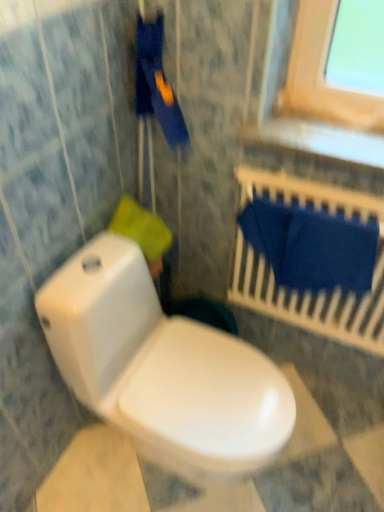
Describe the element at coordinates (309, 290) in the screenshot. This screenshot has height=512, width=384. I see `blue fabric at upper right` at that location.

Where is `white glossy toilet at lower left`? This screenshot has height=512, width=384. white glossy toilet at lower left is located at coordinates (162, 369).

Between blue fabric at upper right and yellow fabric at upper left, which one appears on the right side from the viewer's perspective?

Positioned to the right is blue fabric at upper right.

Is point (383, 292) less distant than point (116, 222)?

Yes, it is.

Can you see blue fabric at upper right touching yellow fabric at upper left?

blue fabric at upper right and yellow fabric at upper left are not in contact.

Consider the image. Considering the sizes of objects blue fabric at upper right and yellow fabric at upper left in the image provided, who is taller, blue fabric at upper right or yellow fabric at upper left?

Standing taller between the two is blue fabric at upper right.

Are white glossy toilet at lower left and blue fabric at upper right far apart?

No.

Could you tell me if white glossy toilet at lower left is turned towards blue fabric at upper right?

No, white glossy toilet at lower left is not oriented towards blue fabric at upper right.

From the image's perspective, is white glossy toilet at lower left over blue fabric at upper right?

No, from the image's perspective, white glossy toilet at lower left is not over blue fabric at upper right.

Locate an element on the screen. The height and width of the screenshot is (512, 384). toilet on the left of blue fabric at upper right is located at coordinates (162, 369).

From the image's perspective, which one is positioned lower, blue fabric at upper right or white glossy toilet at lower left?

white glossy toilet at lower left, from the image's perspective.

How different are the orientations of blue fabric at upper right and white glossy toilet at lower left in degrees?

The facing directions of blue fabric at upper right and white glossy toilet at lower left are 90.9 degrees apart.

Does blue fabric at upper right have a greater height compared to white glossy toilet at lower left?

No.

Is blue fabric at upper right located outside white glossy toilet at lower left?

Absolutely, blue fabric at upper right is external to white glossy toilet at lower left.

The height and width of the screenshot is (512, 384). I want to click on toilet lying below the yellow fabric at upper left (from the image's perspective), so click(x=162, y=369).

From the image's perspective, which is below, yellow fabric at upper left or white glossy toilet at lower left?

white glossy toilet at lower left is shown below in the image.

From a real-world perspective, is yellow fabric at upper left over white glossy toilet at lower left?

Indeed, from a real-world perspective, yellow fabric at upper left stands above white glossy toilet at lower left.

Relative to yellow fabric at upper left, is white glossy toilet at lower left in front or behind?

Clearly, white glossy toilet at lower left is in front of yellow fabric at upper left.

Can you confirm if white glossy toilet at lower left is smaller than yellow fabric at upper left?

No, white glossy toilet at lower left is not smaller than yellow fabric at upper left.

Is white glossy toilet at lower left facing towards yellow fabric at upper left?

No, white glossy toilet at lower left is not turned towards yellow fabric at upper left.

From the image's perspective, which is above, white glossy toilet at lower left or yellow fabric at upper left?

yellow fabric at upper left.

Is yellow fabric at upper left looking in the opposite direction of blue fabric at upper right?

yellow fabric at upper left is not turned away from blue fabric at upper right.

Is yellow fabric at upper left taller than blue fabric at upper right?

Incorrect, the height of yellow fabric at upper left is not larger of that of blue fabric at upper right.

Is yellow fabric at upper left at the left side of blue fabric at upper right?

Indeed, yellow fabric at upper left is positioned on the left side of blue fabric at upper right.

Between yellow fabric at upper left and blue fabric at upper right, which one has larger width?

Wider between the two is yellow fabric at upper left.

Locate an element on the screen. This screenshot has width=384, height=512. balustrade in front of the yellow fabric at upper left is located at coordinates (309, 290).

Where is `balustrade that appears behind the white glossy toilet at lower left`? balustrade that appears behind the white glossy toilet at lower left is located at coordinates (309, 290).

Based on their spatial positions, is white glossy toilet at lower left or yellow fabric at upper left further from blue fabric at upper right?

Among the two, white glossy toilet at lower left is located further to blue fabric at upper right.

Estimate the real-world distances between objects in this image. Which object is further from white glossy toilet at lower left, blue fabric at upper right or yellow fabric at upper left?

Among the two, blue fabric at upper right is located further to white glossy toilet at lower left.

From the picture: Which object lies further to the anchor point white glossy toilet at lower left, yellow fabric at upper left or blue fabric at upper right?

The object further to white glossy toilet at lower left is blue fabric at upper right.

Which object lies nearer to the anchor point blue fabric at upper right, yellow fabric at upper left or white glossy toilet at lower left?

yellow fabric at upper left is positioned closer to the anchor blue fabric at upper right.

Considering their positions, is white glossy toilet at lower left positioned closer to yellow fabric at upper left than blue fabric at upper right?

Among the two, white glossy toilet at lower left is located nearer to yellow fabric at upper left.

When comparing their distances from yellow fabric at upper left, does blue fabric at upper right or white glossy toilet at lower left seem closer?

Based on the image, white glossy toilet at lower left appears to be nearer to yellow fabric at upper left.

Locate an element on the screen. Image resolution: width=384 pixels, height=512 pixels. balustrade between yellow fabric at upper left and white glossy toilet at lower left from top to bottom is located at coordinates (309, 290).